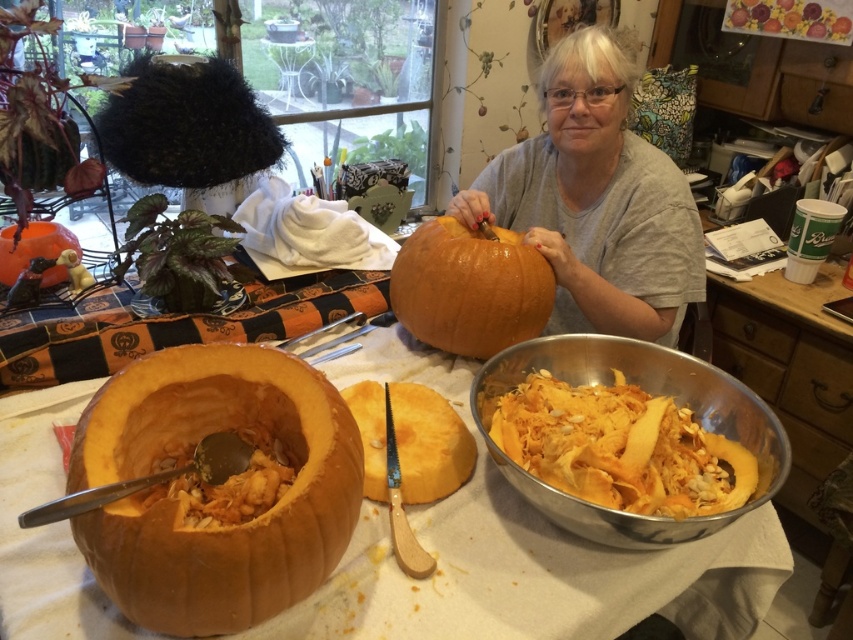
Question: In this image, where is spongy orange pumpkin at lower left located relative to orange matte pumpkin at left?

Choices:
 (A) above
 (B) below

Answer: (B)

Question: Which point is farther to the camera?

Choices:
 (A) (418, 333)
 (B) (300, 394)
 (C) (583, 221)
 (D) (331, 632)

Answer: (C)

Question: Which point is closer to the camera taking this photo?

Choices:
 (A) (253, 467)
 (B) (415, 337)
 (C) (62, 248)
 (D) (439, 484)

Answer: (A)

Question: Where is orange pumpkin at center located in relation to spongy orange pumpkin at lower left in the image?

Choices:
 (A) right
 (B) left

Answer: (A)

Question: Based on their relative distances, which object is nearer to the orange matte pumpkin at lower left?

Choices:
 (A) spongy orange pumpkin at lower left
 (B) glossy orange pumpkin at center

Answer: (A)

Question: Can you confirm if orange matte pumpkin at lower left is positioned to the left of orange matte pumpkin at left?

Choices:
 (A) no
 (B) yes

Answer: (A)